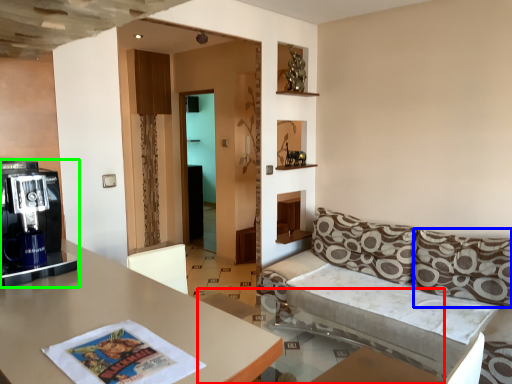
Question: Which is nearer to the glass table (highlighted by a red box)? pillow (highlighted by a blue box) or coffee machine (highlighted by a green box).

Choices:
 (A) pillow
 (B) coffee machine

Answer: (A)